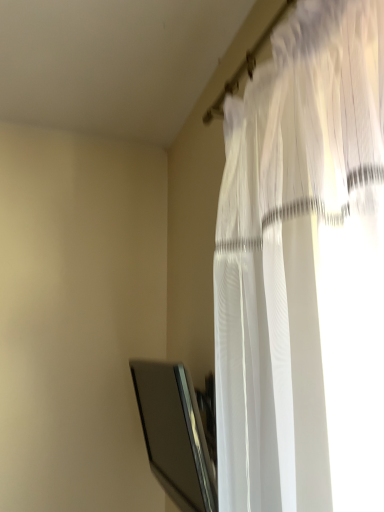
The width and height of the screenshot is (384, 512). Identify the location of matte black monitor at lower left. (174, 434).

The height and width of the screenshot is (512, 384). What do you see at coordinates (174, 434) in the screenshot?
I see `matte black monitor at lower left` at bounding box center [174, 434].

Measure the distance between matte black monitor at lower left and camera.

A distance of 28.80 inches exists between matte black monitor at lower left and camera.

Locate an element on the screen. This screenshot has height=512, width=384. matte black monitor at lower left is located at coordinates (174, 434).